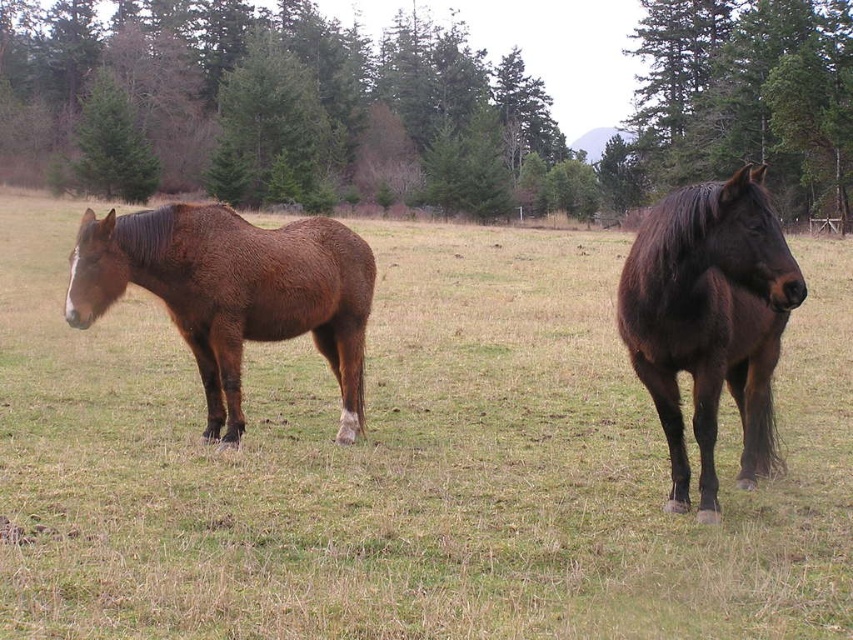
Can you confirm if green matte tree at center is taller than green matte tree at upper left?

Yes, green matte tree at center is taller than green matte tree at upper left.

The width and height of the screenshot is (853, 640). Find the location of `green matte tree at center`. green matte tree at center is located at coordinates (271, 131).

Is green leafy tree at center thinner than brown glossy horse at left?

No, green leafy tree at center is not thinner than brown glossy horse at left.

Which is in front, point (601, 189) or point (137, 230)?

Positioned in front is point (137, 230).

The width and height of the screenshot is (853, 640). Find the location of `green leafy tree at center`. green leafy tree at center is located at coordinates (418, 106).

Does shiny dark brown horse at right have a lesser width compared to green matte tree at upper left?

No, shiny dark brown horse at right is not thinner than green matte tree at upper left.

Does shiny dark brown horse at right have a smaller size compared to green matte tree at upper left?

No, shiny dark brown horse at right is not smaller than green matte tree at upper left.

Does point (729, 308) lie behind point (86, 157)?

No, (729, 308) is closer to viewer.

Identify the location of shiny dark brown horse at right. (709, 321).